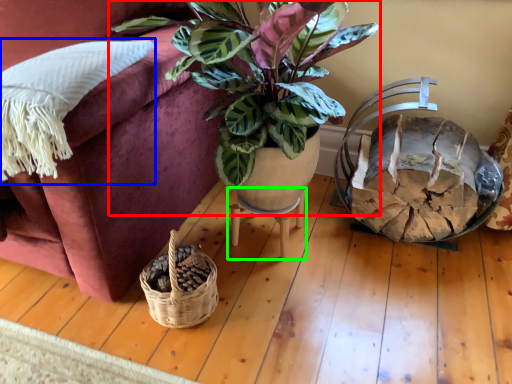
Question: Which object is positioned closest to houseplant (highlighted by a red box)? Select from pillow (highlighted by a blue box) and table (highlighted by a green box).

Choices:
 (A) pillow
 (B) table

Answer: (A)